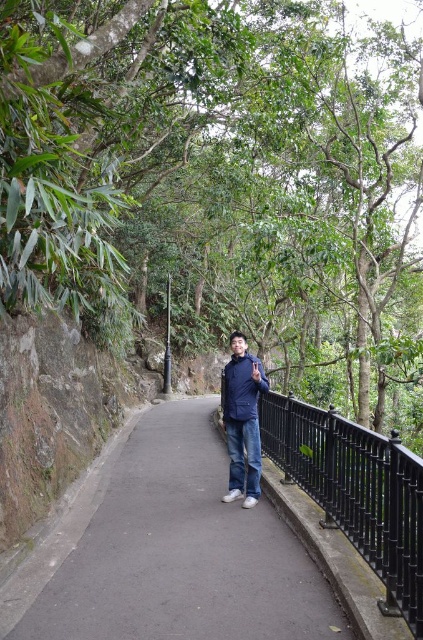
Can you confirm if green leafy tree at center is smaller than navy blue jacket at center?

Actually, green leafy tree at center might be larger than navy blue jacket at center.

Which is behind, point (139, 298) or point (261, 376)?

Point (139, 298)

Where is `green leafy tree at center`? Image resolution: width=423 pixels, height=640 pixels. green leafy tree at center is located at coordinates (216, 172).

Is point (285, 241) positioned behind point (120, 520)?

Yes.

Is green leafy tree at center positioned behind black asphalt path at center?

No.

Does point (131, 129) come farther from viewer compared to point (104, 636)?

That is True.

You are a GUI agent. You are given a task and a screenshot of the screen. Output one action in this format:
    pyautogui.click(x=<x>, y=<y>)
    Task: Click on the green leafy tree at center
    
    Given the screenshot: What is the action you would take?
    pyautogui.click(x=216, y=172)

Between black metal/rail at right and navy blue jacket at center, which one appears on the right side from the viewer's perspective?

Positioned to the right is black metal/rail at right.

Does black metal/rail at right appear on the left side of navy blue jacket at center?

In fact, black metal/rail at right is to the right of navy blue jacket at center.

Consider the image. Who is more distant from viewer, (291, 481) or (258, 452)?

The point (291, 481) is more distant.

You are a GUI agent. You are given a task and a screenshot of the screen. Output one action in this format:
    pyautogui.click(x=<x>, y=<y>)
    Task: Click on the black metal/rail at right
    The image size is (423, 640).
    Given the screenshot: What is the action you would take?
    pyautogui.click(x=356, y=490)